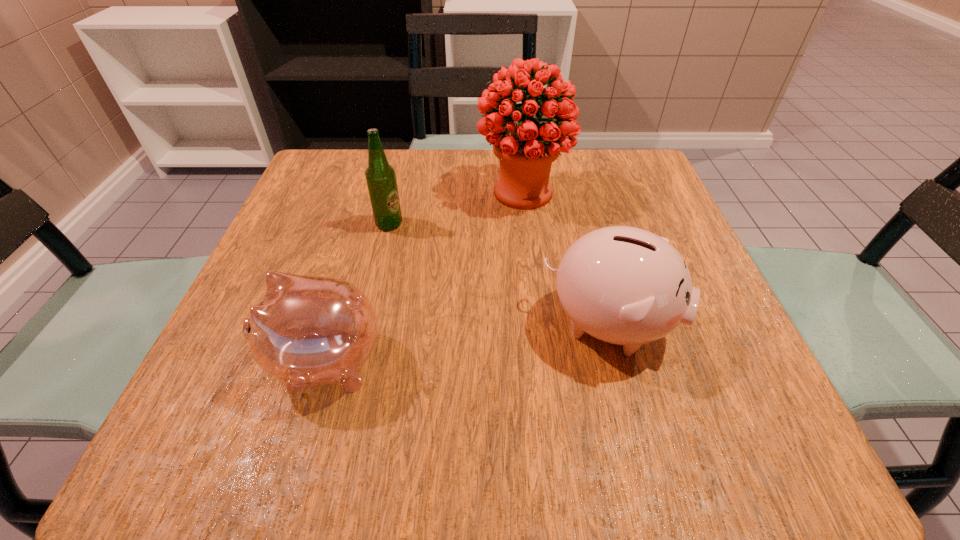
This screenshot has width=960, height=540. I want to click on vacant region between the right piggy bank and the beer bottle, so click(x=499, y=274).

Where is `free space that is in between the right piggy bank and the left piggy bank`? Image resolution: width=960 pixels, height=540 pixels. free space that is in between the right piggy bank and the left piggy bank is located at coordinates (467, 343).

This screenshot has width=960, height=540. I want to click on free space between the beer bottle and the right piggy bank, so click(x=499, y=274).

Find the location of `empty location between the right piggy bank and the left piggy bank`. empty location between the right piggy bank and the left piggy bank is located at coordinates (467, 343).

The width and height of the screenshot is (960, 540). I want to click on vacant space that's between the right piggy bank and the beer bottle, so click(x=499, y=274).

I want to click on free space between the beer bottle and the tallest object, so click(x=456, y=208).

The width and height of the screenshot is (960, 540). What are the coordinates of `vacant area that lies between the right piggy bank and the left piggy bank` in the screenshot? It's located at (467, 343).

In order to click on free point between the tallest object and the left piggy bank in this screenshot , I will do `click(424, 277)`.

Identify the location of free space between the left piggy bank and the right piggy bank. The image size is (960, 540). (467, 343).

Identify the location of free space between the right piggy bank and the beer bottle. Image resolution: width=960 pixels, height=540 pixels. (499, 274).